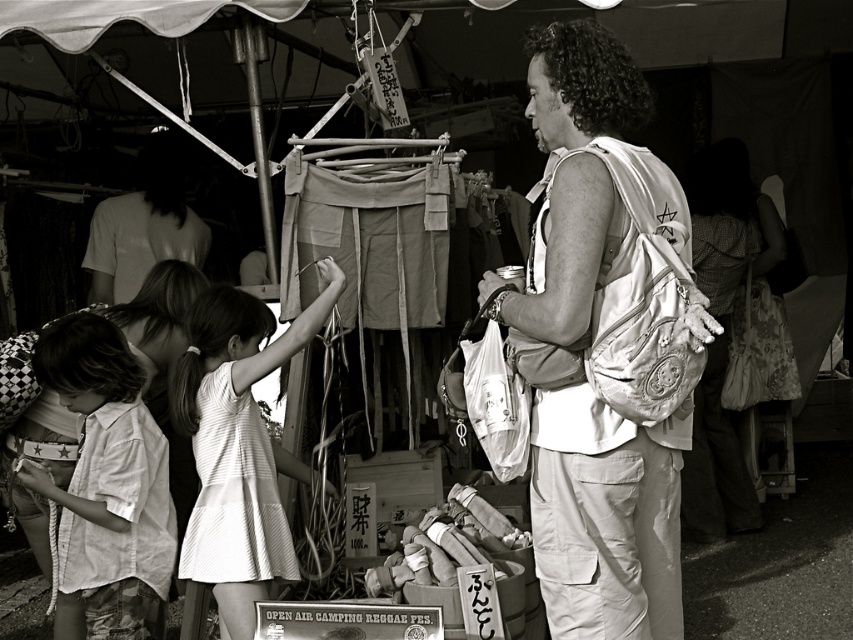
Consider the image. In the market scene, you see a white fabric bag at center and a white striped dress at center. Which object is located to the right of the other?

The white fabric bag at center is positioned on the right side of white striped dress at center.